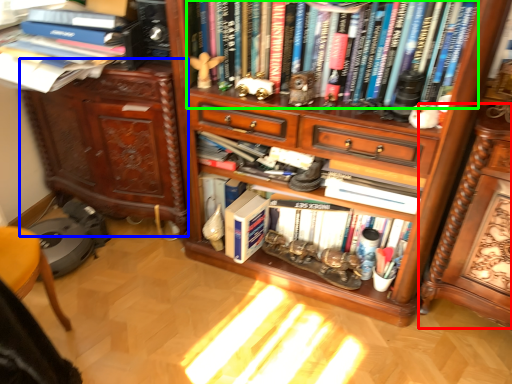
Question: Estimate the real-world distances between objects in this image. Which object is farther from computer desk (highlighted by a red box), cabinetry (highlighted by a blue box) or book (highlighted by a green box)?

Choices:
 (A) cabinetry
 (B) book

Answer: (A)